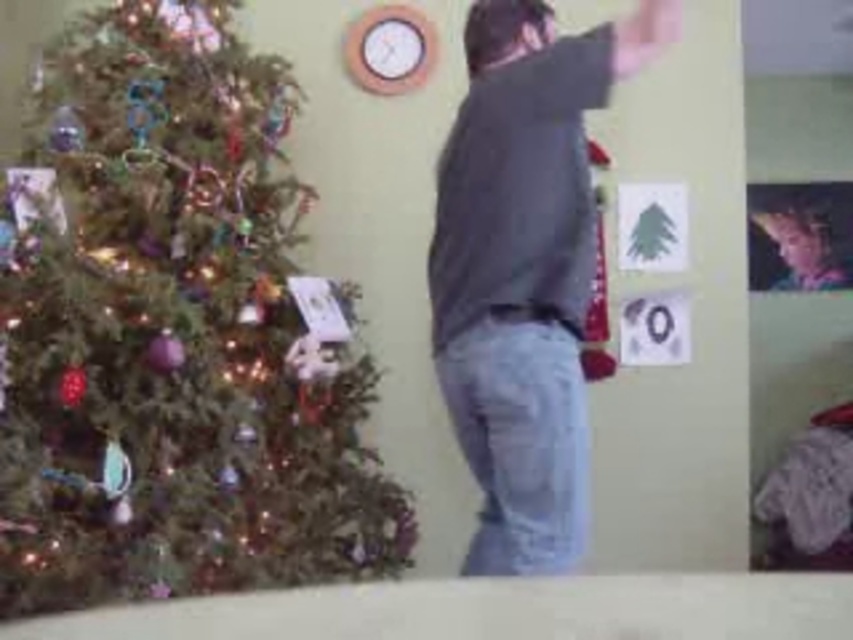
Question: Does shiny green tree at left appear under dark gray hoodie at center?

Choices:
 (A) no
 (B) yes

Answer: (B)

Question: Which object appears closest to the camera in this image?

Choices:
 (A) shiny green tree at left
 (B) dark gray hoodie at center

Answer: (B)

Question: Can you confirm if shiny green tree at left is wider than dark gray hoodie at center?

Choices:
 (A) no
 (B) yes

Answer: (B)

Question: Which point is closer to the camera?

Choices:
 (A) shiny green tree at left
 (B) dark gray hoodie at center

Answer: (B)

Question: Is shiny green tree at left further to camera compared to dark gray hoodie at center?

Choices:
 (A) no
 (B) yes

Answer: (B)